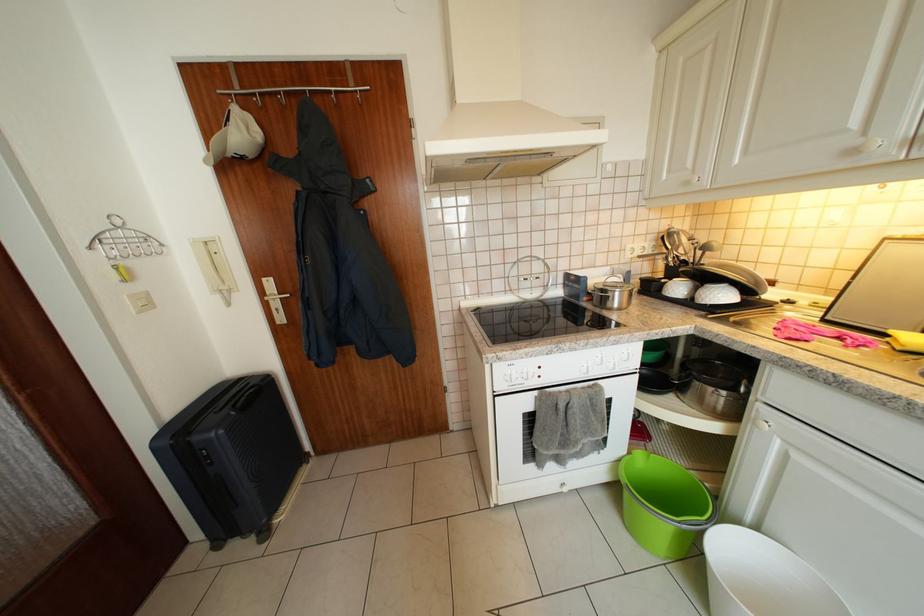
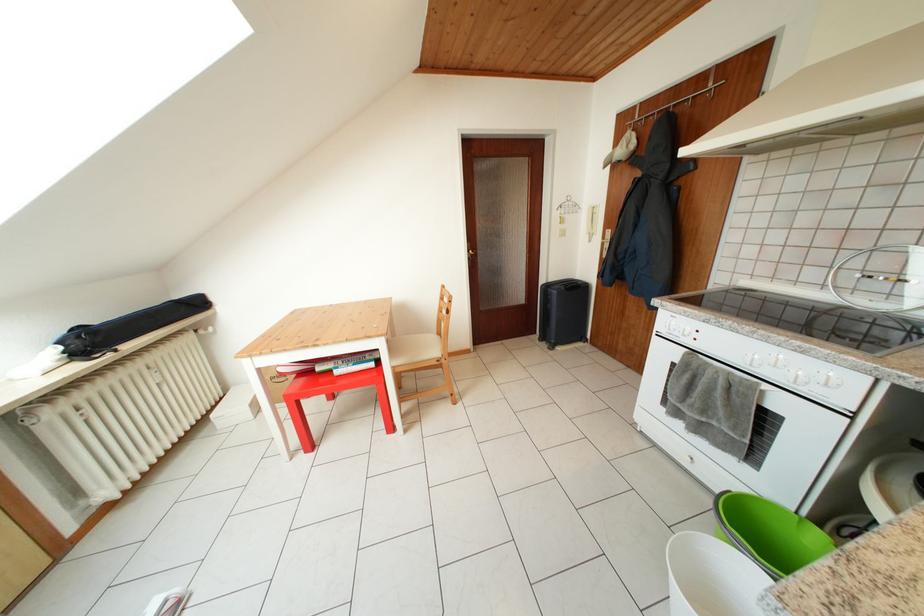
The point at (648, 459) is marked in the first image. Where is the corresponding point in the second image?

(828, 540)